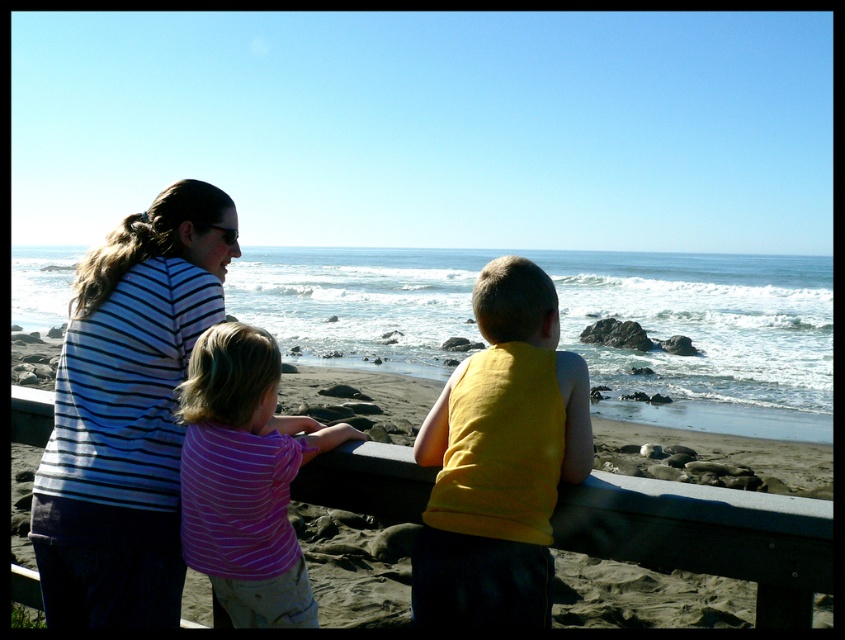
Measure the distance from striped fabric shirt at left to purple striped shirt at center.

striped fabric shirt at left is 10.28 inches from purple striped shirt at center.

Is point (83, 410) positioned after point (221, 346)?

Yes, point (83, 410) is farther from viewer.

Who is more distant from viewer, (112, 614) or (222, 428)?

Point (112, 614)

Where is `striped fabric shirt at left`? striped fabric shirt at left is located at coordinates (127, 413).

Is yellow cotton tank top at center thinner than purple striped shirt at center?

Yes.

Is yellow cotton tank top at center smaller than purple striped shirt at center?

Correct, yellow cotton tank top at center occupies less space than purple striped shirt at center.

Is point (511, 500) closer to viewer compared to point (227, 403)?

Yes, point (511, 500) is closer to viewer.

Locate an element on the screen. The image size is (845, 640). yellow cotton tank top at center is located at coordinates (500, 461).

Does point (80, 324) lie behind point (418, 449)?

Yes.

In the scene shown: Which is more to the right, striped fabric shirt at left or yellow cotton tank top at center?

From the viewer's perspective, yellow cotton tank top at center appears more on the right side.

Find the location of a particular element. Image resolution: width=845 pixels, height=640 pixels. striped fabric shirt at left is located at coordinates (127, 413).

Locate an element on the screen. The image size is (845, 640). striped fabric shirt at left is located at coordinates (127, 413).